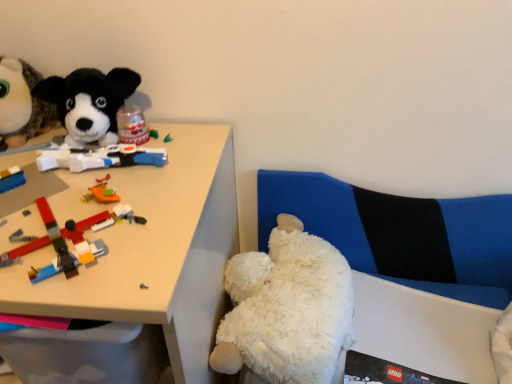
The image size is (512, 384). I want to click on free spot above white plush couch at lower right (from a real-world perspective), so click(x=389, y=171).